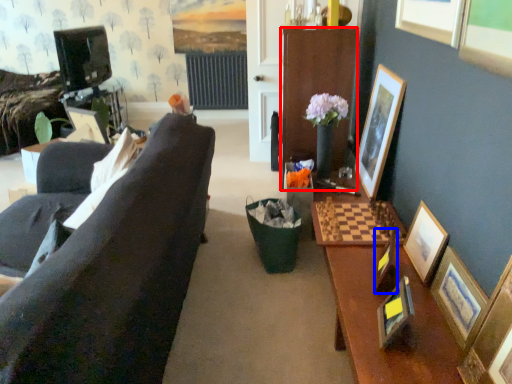
Question: Among these objects, which one is nearest to the camera, cabinetry (highlighted by a red box) or picture frame (highlighted by a blue box)?

Choices:
 (A) cabinetry
 (B) picture frame

Answer: (B)